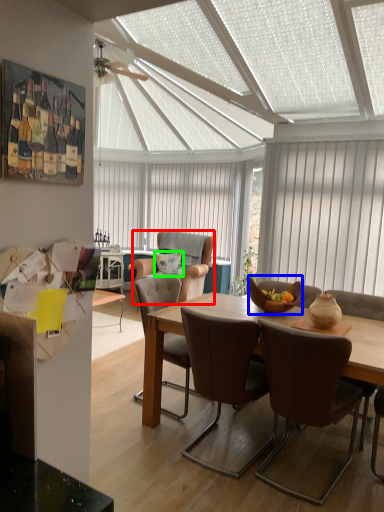
Question: Estimate the real-world distances between objects in this image. Which object is farther from chair (highlighted by a red box), bowl (highlighted by a blue box) or pillow (highlighted by a green box)?

Choices:
 (A) bowl
 (B) pillow

Answer: (A)